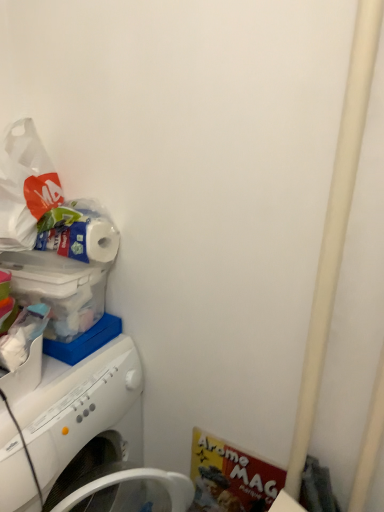
Question: Considering the relative positions of white plastic washing machine at left and white matte toilet paper at upper left in the image provided, is white plastic washing machine at left to the left or to the right of white matte toilet paper at upper left?

Choices:
 (A) left
 (B) right

Answer: (A)

Question: From a real-world perspective, relative to white matte toilet paper at upper left, is white plastic washing machine at left vertically above or below?

Choices:
 (A) above
 (B) below

Answer: (B)

Question: Considering the positions of white plastic washing machine at left and white matte toilet paper at upper left in the image, is white plastic washing machine at left taller or shorter than white matte toilet paper at upper left?

Choices:
 (A) short
 (B) tall

Answer: (B)

Question: In terms of width, does white matte toilet paper at upper left look wider or thinner when compared to white plastic washing machine at left?

Choices:
 (A) thin
 (B) wide

Answer: (A)

Question: Visually, is white matte toilet paper at upper left positioned to the left or to the right of white plastic washing machine at left?

Choices:
 (A) right
 (B) left

Answer: (A)

Question: Is white matte toilet paper at upper left inside the boundaries of white plastic washing machine at left, or outside?

Choices:
 (A) outside
 (B) inside

Answer: (A)

Question: Relative to white plastic washing machine at left, is white matte toilet paper at upper left in front or behind?

Choices:
 (A) behind
 (B) front

Answer: (A)